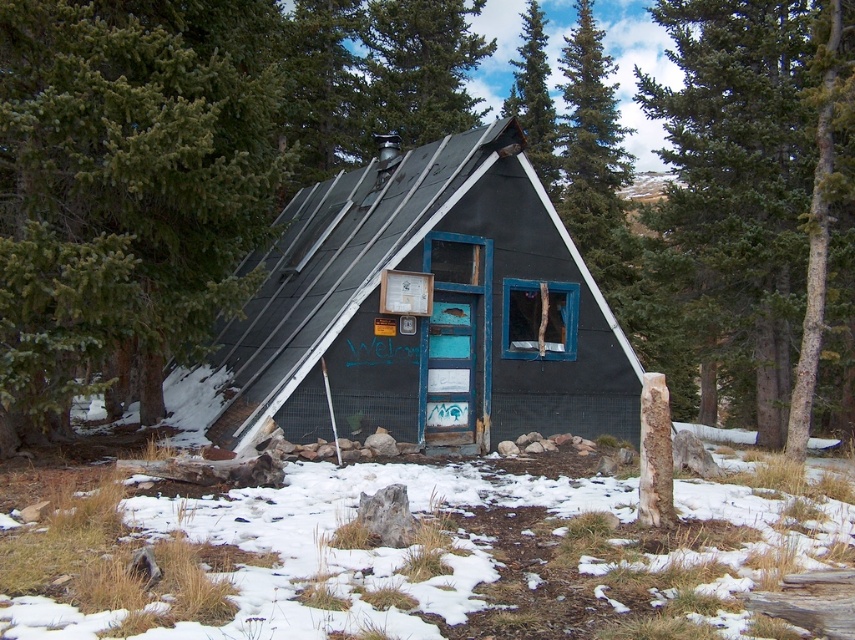
You are standing in front of the cabin and want to take a photo of both the matte black cabin at center and the green leafy tree at upper center. Which object should you focus on first if you want to include both in the frame without moving the camera?

The matte black cabin at center is not as tall as the green leafy tree at upper center, so you should focus on the green leafy tree at upper center first to ensure it fits within the frame.

You are a hiker who wants to take a photo of the matte black cabin at center and the green leafy tree at upper center from a distance. Which object will appear wider in the photo?

The matte black cabin at center will appear wider in the photo because its width is larger than the green leafy tree at upper center.